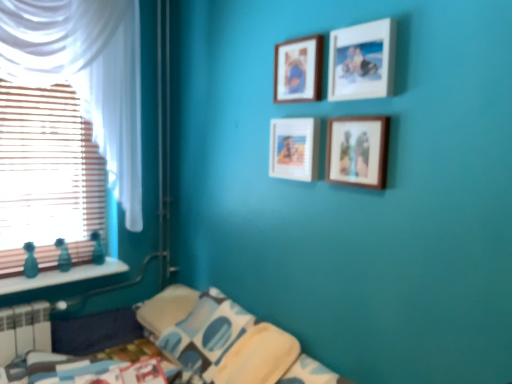
Question: Does wooden picture frame at upper center, the third picture frame in the bottom-to-top sequence, have a greater height compared to teal glass bottles at left?

Choices:
 (A) yes
 (B) no

Answer: (A)

Question: From a real-world perspective, is wooden picture frame at upper center, the second picture frame viewed from the top, over teal glass bottles at left?

Choices:
 (A) yes
 (B) no

Answer: (A)

Question: Can you confirm if wooden picture frame at upper center, the second picture frame viewed from the top, is thinner than teal glass bottles at left?

Choices:
 (A) no
 (B) yes

Answer: (B)

Question: From the image's perspective, does wooden picture frame at upper center, the third picture frame in the bottom-to-top sequence, appear lower than teal glass bottles at left?

Choices:
 (A) yes
 (B) no

Answer: (B)

Question: Does wooden picture frame at upper center, the second picture frame viewed from the top, touch teal glass bottles at left?

Choices:
 (A) yes
 (B) no

Answer: (B)

Question: Is point (62, 201) closer or farther from the camera than point (371, 150)?

Choices:
 (A) closer
 (B) farther

Answer: (B)

Question: Considering their positions, is wooden blinds at left located in front of or behind wooden frame at center, which is counted as the 4th picture frame, starting from the top?

Choices:
 (A) behind
 (B) front

Answer: (A)

Question: From the image's perspective, is wooden blinds at left positioned above or below wooden frame at center, marked as the first picture frame in a bottom-to-top arrangement?

Choices:
 (A) below
 (B) above

Answer: (A)

Question: Is wooden blinds at left situated inside wooden frame at center, which is counted as the 4th picture frame, starting from the top, or outside?

Choices:
 (A) outside
 (B) inside

Answer: (A)

Question: Is white plastic radiator at lower left taller or shorter than blue printed fabric pillow at lower center?

Choices:
 (A) tall
 (B) short

Answer: (B)

Question: Considering the positions of white plastic radiator at lower left and blue printed fabric pillow at lower center in the image, is white plastic radiator at lower left bigger or smaller than blue printed fabric pillow at lower center?

Choices:
 (A) big
 (B) small

Answer: (B)

Question: From a real-world perspective, relative to blue printed fabric pillow at lower center, is white plastic radiator at lower left vertically above or below?

Choices:
 (A) below
 (B) above

Answer: (A)

Question: Is white plastic radiator at lower left inside the boundaries of blue printed fabric pillow at lower center, or outside?

Choices:
 (A) outside
 (B) inside

Answer: (A)

Question: From a real-world perspective, is white plastic radiator at lower left above or below white sheer curtain at left?

Choices:
 (A) below
 (B) above

Answer: (A)

Question: Is white plastic radiator at lower left bigger or smaller than white sheer curtain at left?

Choices:
 (A) small
 (B) big

Answer: (A)